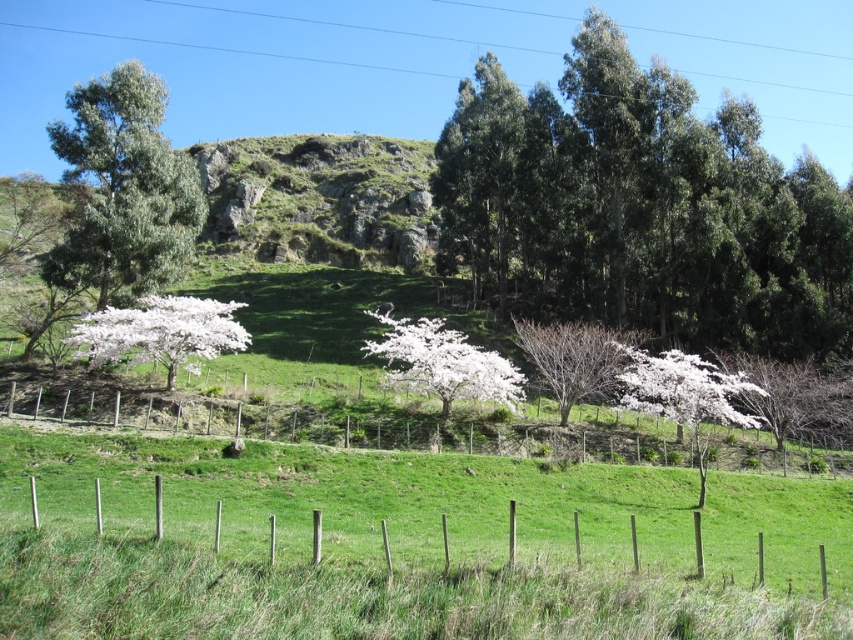
Can you confirm if green leafy tree at left is bigger than bare branches at center?

Yes.

Which is in front, point (148, 154) or point (554, 332)?

Point (554, 332)

Between point (106, 93) and point (561, 349), which one is positioned in front?

Positioned in front is point (561, 349).

Locate an element on the screen. This screenshot has height=640, width=853. green leafy tree at left is located at coordinates (123, 189).

Can you confirm if white blossoms at left is taller than white blossoms at lower right?

Incorrect, white blossoms at left's height is not larger of white blossoms at lower right's.

Does white blossoms at left appear under white blossoms at lower right?

No.

Is point (78, 352) farther from camera compared to point (640, 384)?

No.

Identify the location of white blossoms at left. (161, 332).

Which of these two, wooden post fence at lower center or white blossoms at lower right, stands shorter?

wooden post fence at lower center

From the picture: Can you confirm if wooden post fence at lower center is thinner than white blossoms at lower right?

Incorrect, wooden post fence at lower center's width is not less than white blossoms at lower right's.

At what (x,y) coordinates should I click in order to perform the action: click on wooden post fence at lower center. Please return your answer as a coordinate pair (x, y). This screenshot has height=640, width=853. Looking at the image, I should click on (460, 435).